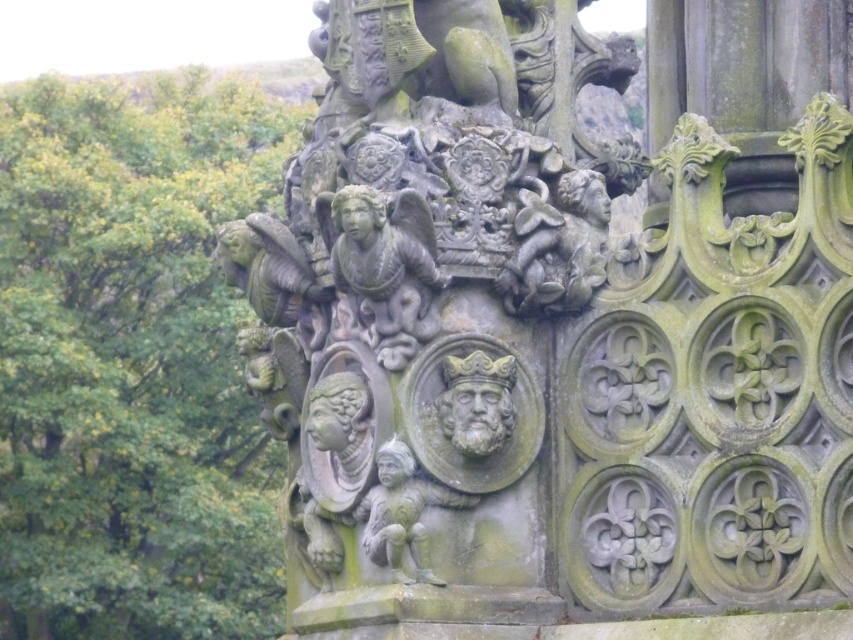
Does green mossy stone tree at upper left appear under gray stone figure at center?

Actually, green mossy stone tree at upper left is above gray stone figure at center.

In the scene shown: Is green mossy stone tree at upper left taller than gray stone figure at center?

Yes.

Between point (112, 548) and point (408, 483), which one is positioned in front?

Point (408, 483) is in front.

This screenshot has width=853, height=640. I want to click on green mossy stone tree at upper left, so click(132, 362).